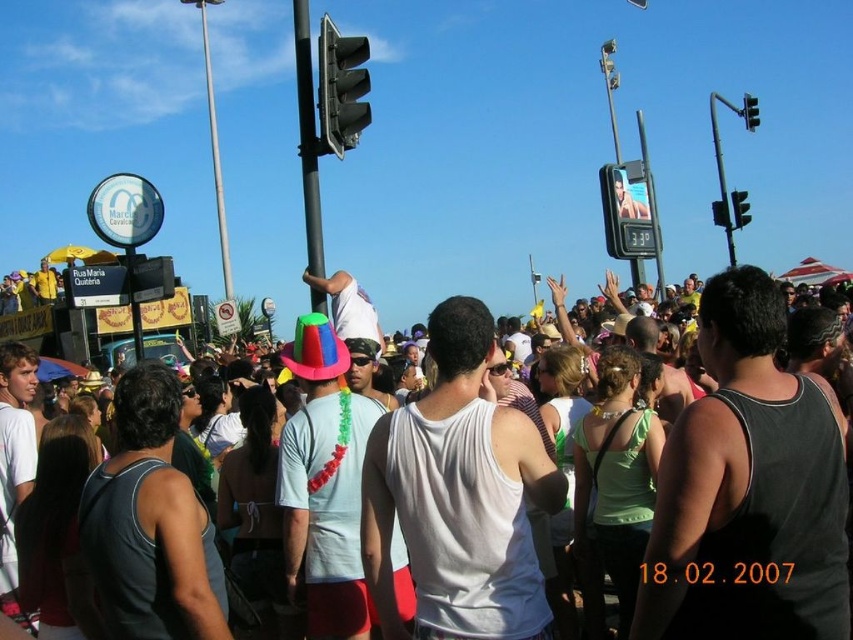
You are a street performer planning to set up a booth. You need to know if the metallic pole at center is wider than the metallic traffic light at upper right to decide where to place your equipment. Can you determine which object is wider?

The metallic pole at center might be wider than metallic traffic light at upper right according to the description.

You are a pedestrian trying to cross the street and see two traffic lights ahead. The first is the metallic gray traffic light at upper center, and the second is the metallic traffic light at upper center. Which traffic light is positioned higher in the image?

The metallic gray traffic light at upper center is above the metallic traffic light at upper center, so it is positioned higher in the image.

You are a photographer trying to capture the metallic gray traffic light at upper center in your shot. Given that your camera has a focal length of 50mm and you are positioned 10 meters away from it, can you estimate the angle of view required to frame the traffic light properly?

The metallic gray traffic light at upper center is located at point coordinates, but without specific dimensions or size information, the exact angle of view cannot be calculated. However, knowing its position helps in adjusting the camera angle to center it in the frame.